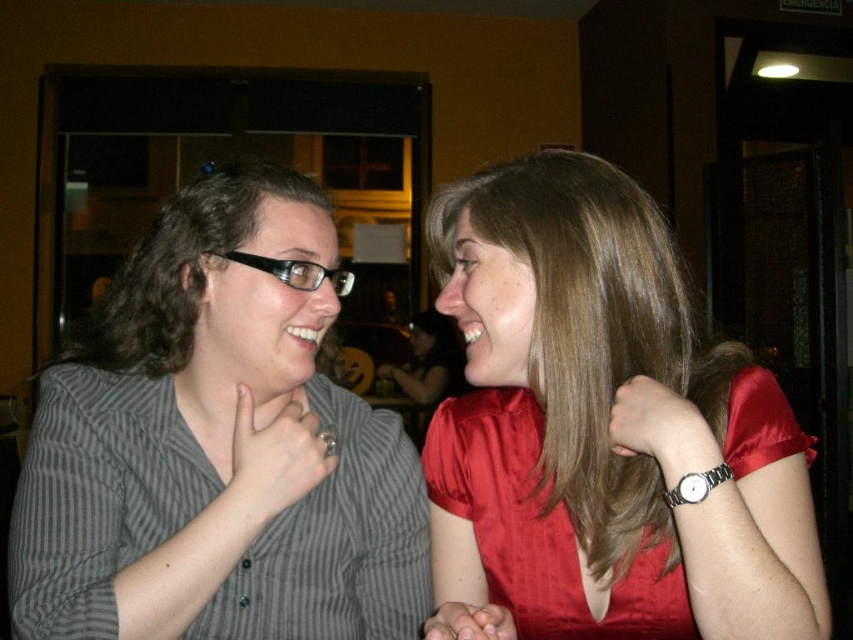
Is striped fabric shirt at left to the left of satin red dress at right from the viewer's perspective?

Correct, you'll find striped fabric shirt at left to the left of satin red dress at right.

The width and height of the screenshot is (853, 640). What are the coordinates of `striped fabric shirt at left` in the screenshot? It's located at tap(218, 445).